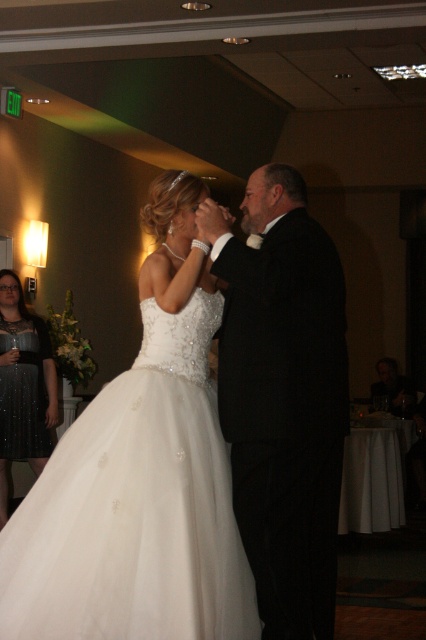
You are a photographer at the wedding reception. You need to position a camera to capture the bride and her father dancing. Given that the white satin dress at center is wider than the black satin suit at center, which object should you ensure is fully in frame first to avoid cropping?

The white satin dress at center is wider than the black satin suit at center, so you should ensure the white satin dress at center is fully in frame first to avoid cropping.

What is located at the coordinate point (140, 477) in the image?

The white satin dress at center is located at point (140, 477).

You are a photographer at the wedding reception. You need to capture a group photo that includes both the white satin dress at center and the sparkly black dress at left. Considering their sizes, which dress should you position closer to the camera to ensure both are visible clearly in the photo?

The white satin dress at center has a larger width than the sparkly black dress at left. To ensure both are visible clearly in the photo, position the white satin dress at center closer to the camera so its larger size doesn not overpower the smaller sparkly black dress at left.